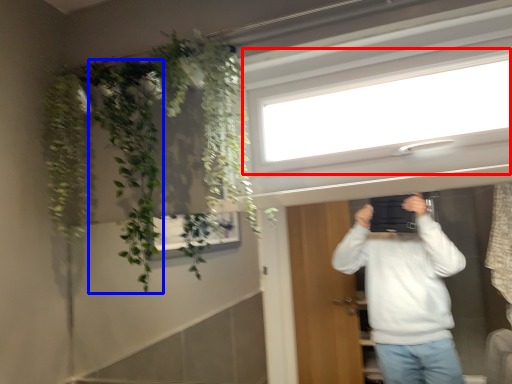
Question: Among these objects, which one is nearest to the camera, window (highlighted by a red box) or plant (highlighted by a blue box)?

Choices:
 (A) window
 (B) plant

Answer: (A)